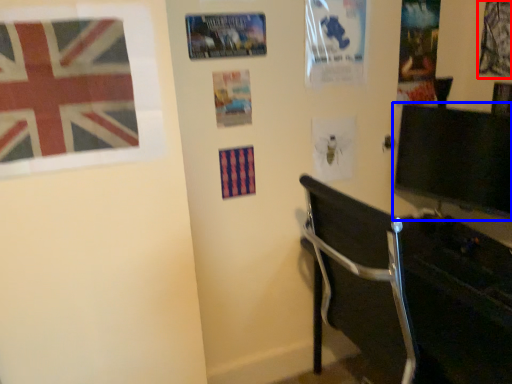
Question: Which point is further to the camera, poster page (highlighted by a red box) or computer monitor (highlighted by a blue box)?

Choices:
 (A) poster page
 (B) computer monitor

Answer: (A)